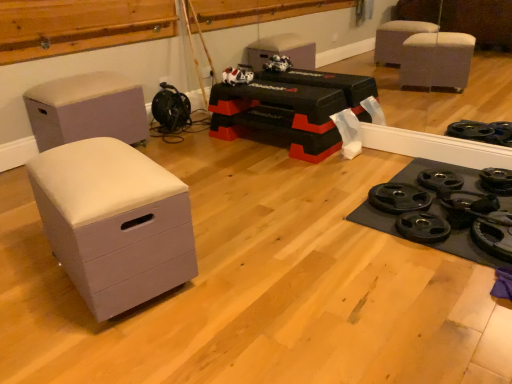
Question: In the image, is white plush cat at center positioned in front of or behind white matte chest of drawers at left?

Choices:
 (A) behind
 (B) front

Answer: (A)

Question: Is white plush cat at center to the left or to the right of white matte chest of drawers at left in the image?

Choices:
 (A) left
 (B) right

Answer: (B)

Question: Estimate the real-world distances between objects in this image. Which object is closer to the black rubber weight plate at lower right?

Choices:
 (A) white plush cat at center
 (B) beige fabric ottoman at left
 (C) white matte chest of drawers at left

Answer: (C)

Question: Which object is the farthest from the black rubber weight plate at lower right?

Choices:
 (A) white plush cat at center
 (B) beige fabric ottoman at left
 (C) white matte chest of drawers at left

Answer: (B)